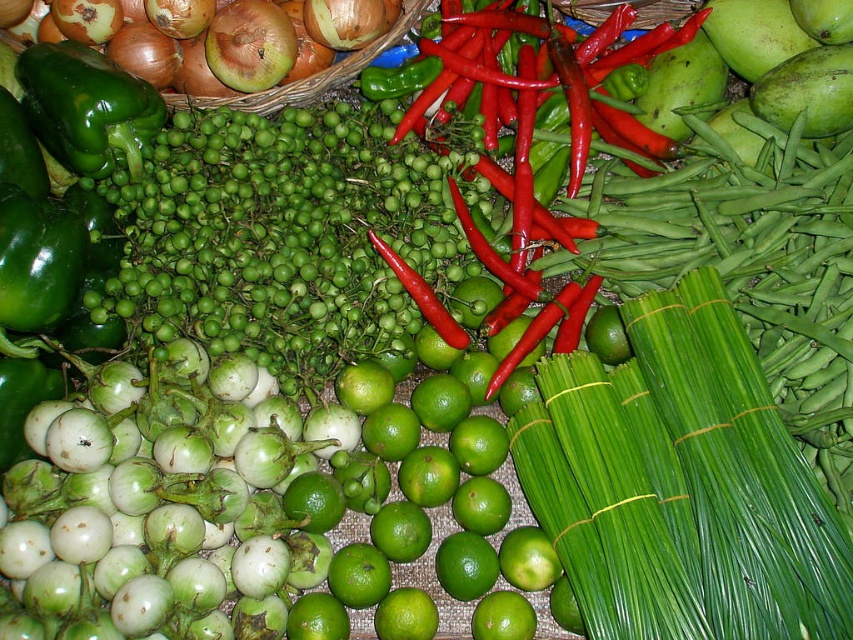
Does green matte bell pepper at upper left appear over green matte onion at upper left?

Incorrect, green matte bell pepper at upper left is not positioned above green matte onion at upper left.

Is the position of green matte bell pepper at upper left more distant than that of green matte onion at upper left?

No, green matte bell pepper at upper left is closer to the viewer.

Is point (70, 113) positioned before point (264, 52)?

Yes, point (70, 113) is closer to viewer.

The height and width of the screenshot is (640, 853). What are the coordinates of `green matte bell pepper at upper left` in the screenshot? It's located at (86, 108).

Which is more to the right, green matte onion at upper left or smooth brown onion at upper left?

green matte onion at upper left

Is green matte onion at upper left taller than smooth brown onion at upper left?

Yes.

Identify the location of green matte onion at upper left. (250, 45).

Locate an element on the screen. The width and height of the screenshot is (853, 640). green matte onion at upper left is located at coordinates (250, 45).

Between brown textured onion at upper left and smooth brown onion at upper left, which one has more height?

With more height is brown textured onion at upper left.

Locate an element on the screen. Image resolution: width=853 pixels, height=640 pixels. brown textured onion at upper left is located at coordinates (215, 38).